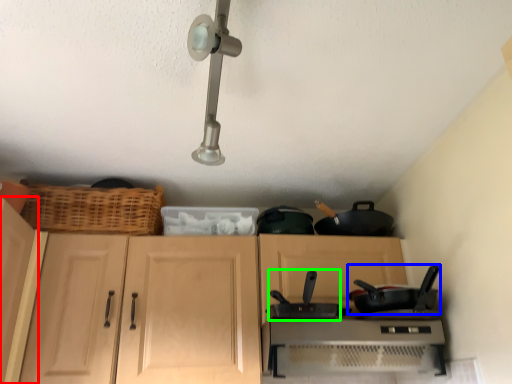
Question: Based on their relative distances, which object is farther from cabinetry (highlighted by a red box)? Choose from frying pan (highlighted by a blue box) and wok (highlighted by a green box).

Choices:
 (A) frying pan
 (B) wok

Answer: (A)